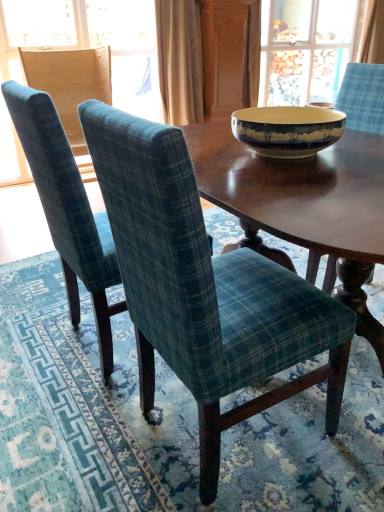
Question: Should I look upward or downward to see green plaid fabric chair at center, the third chair when ordered from left to right?

Choices:
 (A) up
 (B) down

Answer: (A)

Question: Can you see green plaid fabric chair at center, the third chair when ordered from left to right, touching blue fabric chair at left?

Choices:
 (A) no
 (B) yes

Answer: (A)

Question: Is blue fabric chair at left at the back of green plaid fabric chair at center, the third chair when ordered from left to right?

Choices:
 (A) no
 (B) yes

Answer: (A)

Question: Is blue fabric chair at left located within green plaid fabric chair at center, the third chair when ordered from left to right?

Choices:
 (A) no
 (B) yes

Answer: (A)

Question: Is green plaid fabric chair at center, which appears as the first chair when viewed from the right, taller than blue fabric chair at left?

Choices:
 (A) yes
 (B) no

Answer: (B)

Question: Does green plaid fabric chair at center, the third chair when ordered from left to right, have a smaller size compared to blue fabric chair at left?

Choices:
 (A) no
 (B) yes

Answer: (A)

Question: Is green plaid fabric chair at center, the third chair when ordered from left to right, at the left side of blue fabric chair at left?

Choices:
 (A) no
 (B) yes

Answer: (A)

Question: Is teal plaid chair at center, the 2th chair viewed from the left, positioned before blue plaid curtain at upper right, which is counted as the 2th curtain, starting from the front?

Choices:
 (A) no
 (B) yes

Answer: (B)

Question: From a real-world perspective, is teal plaid chair at center, the 2th chair viewed from the left, positioned over blue plaid curtain at upper right, acting as the 1th curtain starting from the right, based on gravity?

Choices:
 (A) no
 (B) yes

Answer: (A)

Question: Considering the relative positions of teal plaid chair at center, which is the 2th chair in right-to-left order, and blue plaid curtain at upper right, marked as the first curtain in a back-to-front arrangement, in the image provided, is teal plaid chair at center, which is the 2th chair in right-to-left order, to the right of blue plaid curtain at upper right, marked as the first curtain in a back-to-front arrangement, from the viewer's perspective?

Choices:
 (A) yes
 (B) no

Answer: (B)

Question: Is teal plaid chair at center, the 2th chair viewed from the left, outside of blue plaid curtain at upper right, the second curtain ordered from the bottom?

Choices:
 (A) no
 (B) yes

Answer: (B)

Question: From the image's perspective, is teal plaid chair at center, the 2th chair viewed from the left, on top of blue plaid curtain at upper right, marked as the first curtain in a back-to-front arrangement?

Choices:
 (A) yes
 (B) no

Answer: (B)

Question: Does teal plaid chair at center, the 2th chair viewed from the left, have a lesser width compared to blue plaid curtain at upper right, acting as the 1th curtain starting from the right?

Choices:
 (A) no
 (B) yes

Answer: (A)

Question: From the image's perspective, would you say teal plaid chair at center, the 2th chair viewed from the left, is shown under wooden screen door at upper center?

Choices:
 (A) no
 (B) yes

Answer: (B)